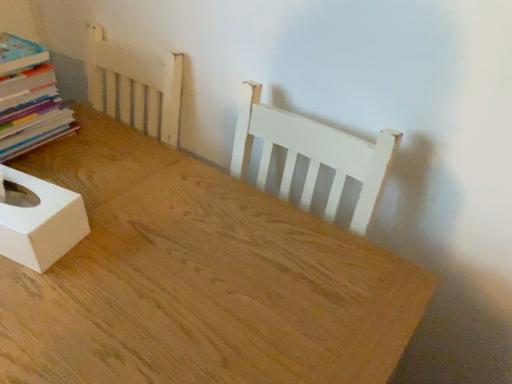
What do you see at coordinates (29, 99) in the screenshot? I see `multicolored paper stack at left` at bounding box center [29, 99].

From the picture: Measure the distance between white matte tissue box at lower left and camera.

white matte tissue box at lower left and camera are 25.87 inches apart from each other.

In order to face natural wood table at center, should I rotate leftwards or rightwards?

A 17.816 degree turn to the left will do.

In order to click on multicolored paper stack at left in this screenshot , I will do point(29,99).

Can you tell me how much multicolored paper stack at left and natural wood table at center differ in facing direction?

89.8 degrees.

In terms of size, does multicolored paper stack at left appear bigger or smaller than natural wood table at center?

Considering their sizes, multicolored paper stack at left takes up less space than natural wood table at center.

In the scene shown: Between multicolored paper stack at left and natural wood table at center, which one has smaller width?

Thinner between the two is multicolored paper stack at left.

There is a natural wood table at center. What are the coordinates of `book above it (from a real-world perspective)` in the screenshot? It's located at (29, 99).

Which is correct: multicolored paper stack at left is inside white matte tissue box at lower left, or outside of it?

The correct answer is: outside.

From the picture: Based on their positions, is multicolored paper stack at left located to the left or right of white matte tissue box at lower left?

multicolored paper stack at left is positioned on white matte tissue box at lower left's left side.

Is multicolored paper stack at left with white matte tissue box at lower left?

No, multicolored paper stack at left is not with white matte tissue box at lower left.

Which of these two, multicolored paper stack at left or white matte tissue box at lower left, is smaller?

With smaller size is white matte tissue box at lower left.

Which of these two, natural wood table at center or multicolored paper stack at left, is wider?

natural wood table at center.

Is point (157, 343) in front of point (26, 53)?

Yes, point (157, 343) is in front of point (26, 53).

From a real-world perspective, is natural wood table at center on multicolored paper stack at left?

No, from a real-world perspective, natural wood table at center is not on top of multicolored paper stack at left.

Does natural wood table at center have a lesser width compared to white matte tissue box at lower left?

No.

Which is more to the left, natural wood table at center or white matte tissue box at lower left?

From the viewer's perspective, white matte tissue box at lower left appears more on the left side.

Is natural wood table at center looking in the opposite direction of white matte tissue box at lower left?

That's not correct — natural wood table at center is not looking away from white matte tissue box at lower left.

Does natural wood table at center touch white matte tissue box at lower left?

natural wood table at center and white matte tissue box at lower left are not in contact.

Is white matte tissue box at lower left oriented away from natural wood table at center?

No, white matte tissue box at lower left's orientation is not away from natural wood table at center.

From the image's perspective, which is below, white matte tissue box at lower left or natural wood table at center?

natural wood table at center appears lower in the image.

Is white matte tissue box at lower left positioned far away from natural wood table at center?

That's not correct — white matte tissue box at lower left is a little close to natural wood table at center.

Does white matte tissue box at lower left have a greater width compared to multicolored paper stack at left?

No.

Who is smaller, white matte tissue box at lower left or multicolored paper stack at left?

Smaller between the two is white matte tissue box at lower left.

Does white matte tissue box at lower left have a greater height compared to multicolored paper stack at left?

No.

Between white matte tissue box at lower left and multicolored paper stack at left, which one appears on the right side from the viewer's perspective?

white matte tissue box at lower left is more to the right.

Identify the location of book behind the natural wood table at center. (29, 99).

Locate an element on the screen. The image size is (512, 384). book above the white matte tissue box at lower left (from the image's perspective) is located at coordinates (29, 99).

Which object lies nearer to the anchor point multicolored paper stack at left, white matte tissue box at lower left or natural wood table at center?

white matte tissue box at lower left is positioned closer to the anchor multicolored paper stack at left.

Which object lies nearer to the anchor point natural wood table at center, white matte tissue box at lower left or multicolored paper stack at left?

white matte tissue box at lower left is closer to natural wood table at center.

Considering their positions, is multicolored paper stack at left positioned further to white matte tissue box at lower left than natural wood table at center?

Among the two, multicolored paper stack at left is located further to white matte tissue box at lower left.

Estimate the real-world distances between objects in this image. Which object is closer to white matte tissue box at lower left, natural wood table at center or multicolored paper stack at left?

Based on the image, natural wood table at center appears to be nearer to white matte tissue box at lower left.

Considering their positions, is natural wood table at center positioned further to multicolored paper stack at left than white matte tissue box at lower left?

natural wood table at center.

Consider the image. Based on their spatial positions, is multicolored paper stack at left or white matte tissue box at lower left closer to natural wood table at center?

Among the two, white matte tissue box at lower left is located nearer to natural wood table at center.

Locate an element on the screen. box between multicolored paper stack at left and natural wood table at center vertically is located at coordinates (41, 223).